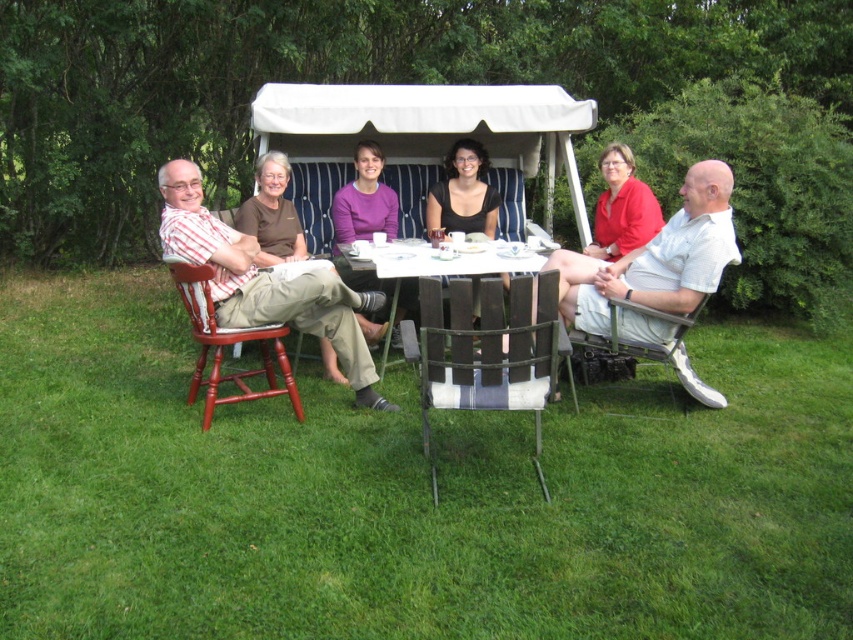
Question: Which object appears closest to the camera in this image?

Choices:
 (A) black matte shirt at center
 (B) purple matte sweater at center
 (C) white fabric chair at right

Answer: (C)

Question: Does matte brown shirt at center have a greater width compared to white wood table at center?

Choices:
 (A) yes
 (B) no

Answer: (B)

Question: Does red matte shirt at center lie behind black matte shirt at center?

Choices:
 (A) no
 (B) yes

Answer: (A)

Question: Which point appears farthest from the camera in this image?

Choices:
 (A) (276, 262)
 (B) (459, 161)
 (C) (566, 353)

Answer: (B)

Question: Is white wood table at center positioned behind black matte shirt at center?

Choices:
 (A) no
 (B) yes

Answer: (A)

Question: Among these objects, which one is farthest from the camera?

Choices:
 (A) matte wood chair at left
 (B) white fabric chair at right

Answer: (B)